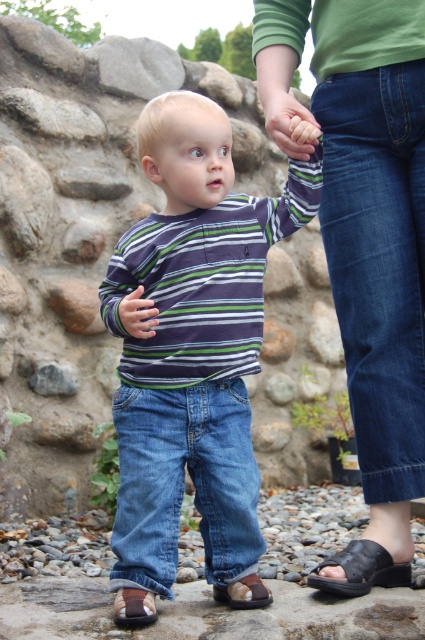
The width and height of the screenshot is (425, 640). Describe the element at coordinates (379, 262) in the screenshot. I see `denim jeans at lower right` at that location.

Where is `denim jeans at lower right`? This screenshot has height=640, width=425. denim jeans at lower right is located at coordinates (379, 262).

Is blue denim jeans at center thinner than brown leather sandal at lower center?

No.

Is blue denim jeans at center to the right of brown leather sandal at lower center from the viewer's perspective?

No, blue denim jeans at center is not to the right of brown leather sandal at lower center.

Which is behind, point (243, 442) or point (240, 582)?

The point (240, 582) is behind.

Locate an element on the screen. blue denim jeans at center is located at coordinates (184, 483).

Is point (362, 564) positioned before point (278, 125)?

That is False.

In the scene shown: Can you confirm if brown leather sandal at lower right is smaller than matte skin hand at center?

Yes, brown leather sandal at lower right is smaller than matte skin hand at center.

Who is more forward, (353, 564) or (306, 157)?

Point (306, 157) is in front.

This screenshot has height=640, width=425. I want to click on brown leather sandal at lower right, so click(x=360, y=570).